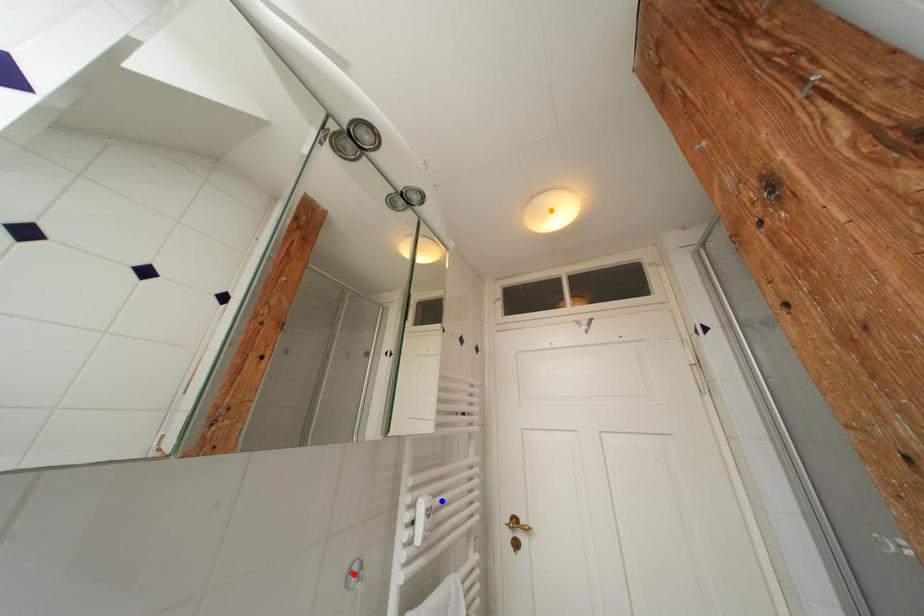
Order these from nearest to farthest:
1. orange point
2. red point
3. blue point

1. red point
2. blue point
3. orange point